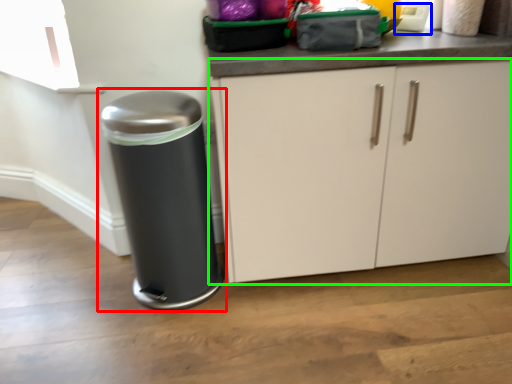
Question: Which object is the farthest from waste container (highlighted by a red box)? Choose among these: appliance (highlighted by a blue box) or cabinetry (highlighted by a green box).

Choices:
 (A) appliance
 (B) cabinetry

Answer: (A)